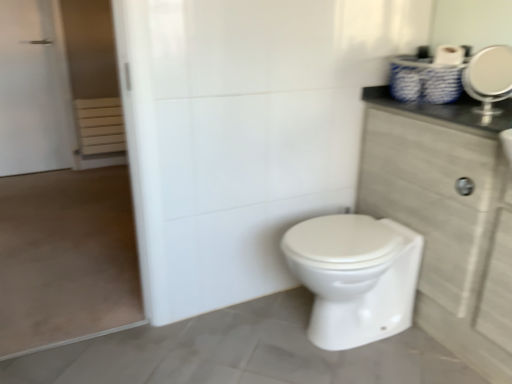
Question: From the image's perspective, is white glossy toilet at center beneath white matte screen door at left?

Choices:
 (A) yes
 (B) no

Answer: (A)

Question: Is the position of white glossy toilet at center more distant than that of white matte screen door at left?

Choices:
 (A) no
 (B) yes

Answer: (B)

Question: Can you confirm if white glossy toilet at center is positioned to the left of white matte screen door at left?

Choices:
 (A) yes
 (B) no

Answer: (B)

Question: Can you confirm if white glossy toilet at center is wider than white matte screen door at left?

Choices:
 (A) yes
 (B) no

Answer: (A)

Question: Is white glossy toilet at center facing towards white matte screen door at left?

Choices:
 (A) yes
 (B) no

Answer: (A)

Question: Considering the positions of point (490, 57) and point (379, 195), is point (490, 57) closer or farther from the camera than point (379, 195)?

Choices:
 (A) farther
 (B) closer

Answer: (B)

Question: Visually, is silver metallic mirror at upper right positioned to the left or to the right of wooden cabinet at right?

Choices:
 (A) left
 (B) right

Answer: (B)

Question: From their relative heights in the image, would you say silver metallic mirror at upper right is taller or shorter than wooden cabinet at right?

Choices:
 (A) short
 (B) tall

Answer: (A)

Question: Would you say silver metallic mirror at upper right is inside or outside wooden cabinet at right?

Choices:
 (A) outside
 (B) inside

Answer: (A)

Question: Is wooden cabinet at right inside or outside of white matte screen door at left?

Choices:
 (A) outside
 (B) inside

Answer: (A)

Question: Based on their sizes in the image, would you say wooden cabinet at right is bigger or smaller than white matte screen door at left?

Choices:
 (A) small
 (B) big

Answer: (B)

Question: Would you say wooden cabinet at right is to the left or to the right of white matte screen door at left in the picture?

Choices:
 (A) left
 (B) right

Answer: (B)

Question: From the image's perspective, is wooden cabinet at right located above or below white matte screen door at left?

Choices:
 (A) above
 (B) below

Answer: (B)

Question: From a real-world perspective, relative to white glossy toilet at center, is white matte screen door at left vertically above or below?

Choices:
 (A) below
 (B) above

Answer: (B)

Question: In terms of size, does white matte screen door at left appear bigger or smaller than white glossy toilet at center?

Choices:
 (A) big
 (B) small

Answer: (A)